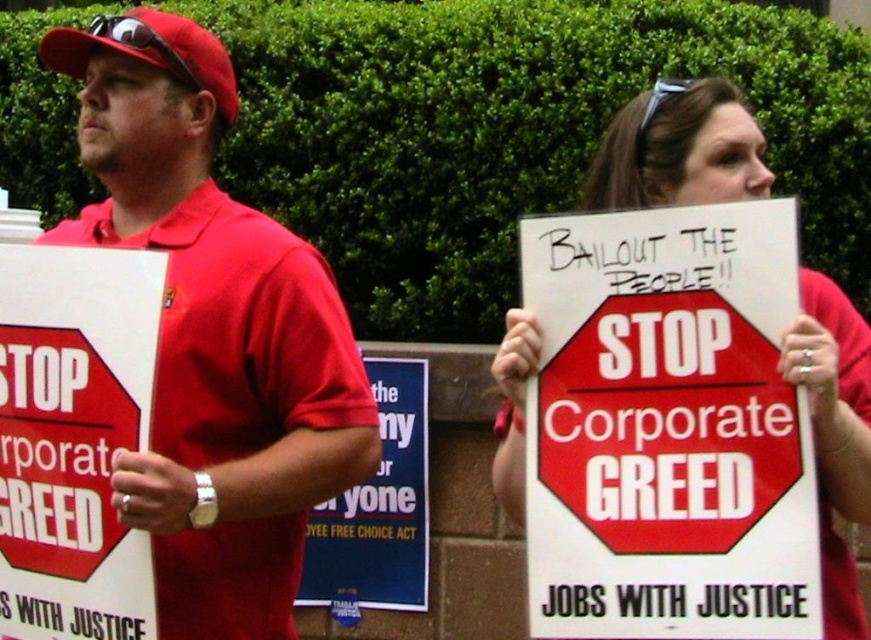
Question: Which point is farther to the camera?

Choices:
 (A) (231, 81)
 (B) (342, 545)
 (C) (73, 362)

Answer: (B)

Question: From the image, what is the correct spatial relationship of matte red stop sign at left in relation to white paper sign at center?

Choices:
 (A) below
 (B) above

Answer: (B)

Question: Which of these objects is positioned farthest from the matte red stop sign at left?

Choices:
 (A) matte white sign at center
 (B) matte red shirt at left
 (C) white paper sign at center
 (D) matte red baseball cap at upper left

Answer: (C)

Question: Is matte white sign at center wider than matte red baseball cap at upper left?

Choices:
 (A) yes
 (B) no

Answer: (B)

Question: Does matte red shirt at left appear on the left side of matte red stop sign at left?

Choices:
 (A) no
 (B) yes

Answer: (A)

Question: Which object is closer to the camera taking this photo?

Choices:
 (A) matte red shirt at left
 (B) matte red baseball cap at upper left
 (C) matte white sign at center

Answer: (C)